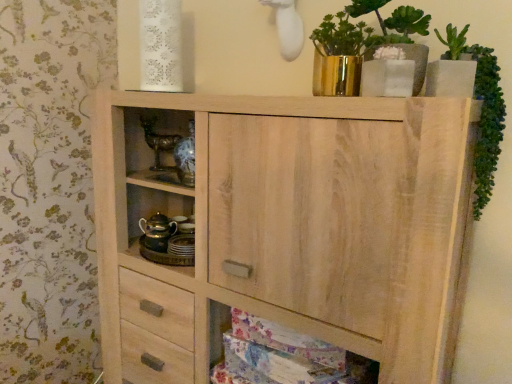
Question: Which is correct: natural wood cabinet at center is inside gold metallic teapot at center left, or outside of it?

Choices:
 (A) outside
 (B) inside

Answer: (A)

Question: Based on their sizes in the image, would you say natural wood cabinet at center is bigger or smaller than gold metallic teapot at center left?

Choices:
 (A) big
 (B) small

Answer: (A)

Question: Estimate the real-world distances between objects in this image. Which object is closer to the gold reflective vase at upper center?

Choices:
 (A) gold metallic teapot at center left
 (B) natural wood cabinet at center
 (C) natural wood cabinet at lower center
 (D) green leafy plant at upper right

Answer: (D)

Question: Which object is the farthest from the natural wood cabinet at center?

Choices:
 (A) green leafy plant at upper right
 (B) gold reflective vase at upper center
 (C) gold metallic teapot at center left
 (D) natural wood cabinet at lower center

Answer: (A)